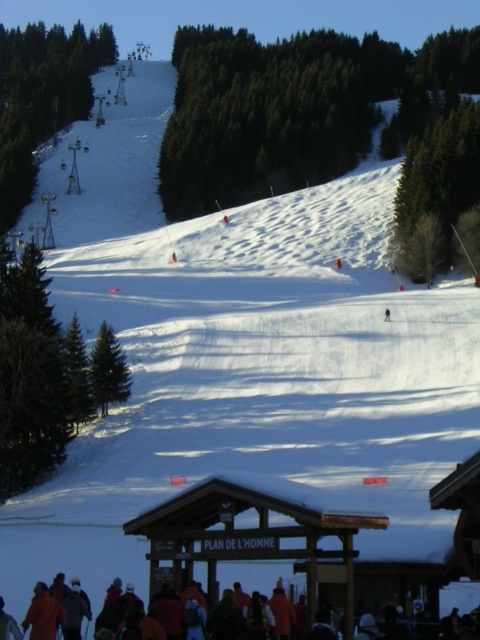
You are a photographer standing at the entrance of the ski resort structure. You want to take a photo of the orange fabric jacket at lower center and the dark blue jacket at lower left. Which jacket is closer to the camera?

The orange fabric jacket at lower center is closer to the camera because it is positioned under the dark blue jacket at lower left, meaning it is in front of the dark blue jacket.

You are standing at the entrance of the wooden structure with the sign that reads PLAN DE L HOMME. You want to hand out a brochure to the closest person wearing either the orange ski jacket at lower left or the dark blue jacket at lower left. Which jacket should you approach?

The orange ski jacket at lower left is 5.77 feet away from dark blue jacket at lower left. Since you want the closest person, you should approach the orange ski jacket at lower left because it is closer to the entrance than the dark blue jacket at lower left.

You are a photographer standing at the entrance of the wooden structure. You want to take a photo of the orange fabric jacket at lower center and the orange ski jacket at lower left. Which jacket should you focus on if you want to capture the wider one in the frame?

The orange fabric jacket at lower center might be wider than the orange ski jacket at lower left, so focusing on the orange fabric jacket at lower center would likely capture the wider one in the frame.